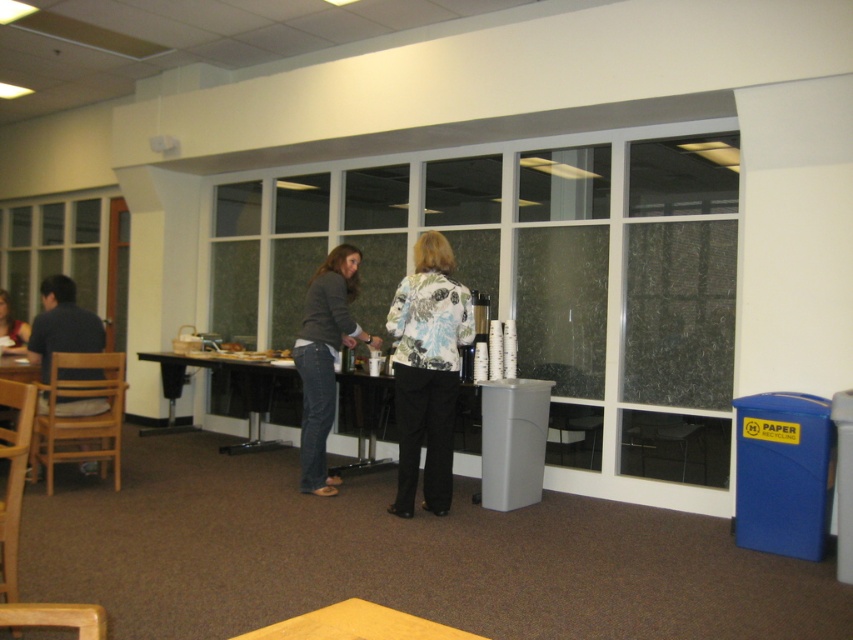
Question: Which point is closer to the camera?

Choices:
 (A) (355, 337)
 (B) (440, 438)
 (C) (251, 413)
 (D) (62, 301)

Answer: (B)

Question: Can you confirm if floral-patterned jacket at center is positioned below denim jeans at center?

Choices:
 (A) no
 (B) yes

Answer: (A)

Question: Does floral-patterned jacket at center have a lesser width compared to denim jeans at center?

Choices:
 (A) yes
 (B) no

Answer: (A)

Question: Is floral-patterned jacket at center to the left of black laminate table at center from the viewer's perspective?

Choices:
 (A) no
 (B) yes

Answer: (A)

Question: Which point is farther to the camera?

Choices:
 (A) black laminate table at center
 (B) dark blue shirt at left

Answer: (A)

Question: Which of these objects is positioned farthest from the denim jeans at center?

Choices:
 (A) black laminate table at center
 (B) dark blue shirt at left
 (C) floral-patterned jacket at center

Answer: (B)